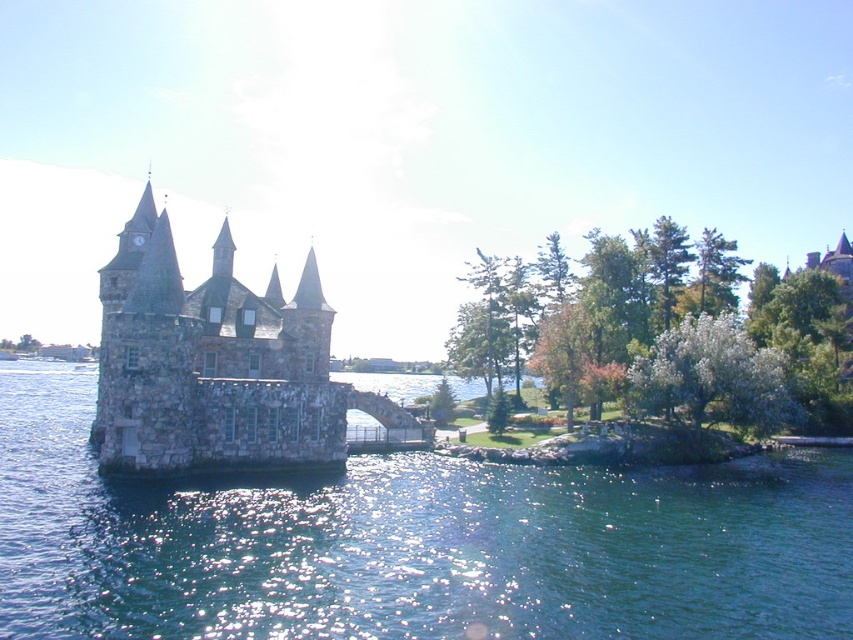
Can you confirm if clear blue water at center is positioned above stone castle at center?

Incorrect, clear blue water at center is not positioned above stone castle at center.

Is point (480, 608) farther from viewer compared to point (189, 428)?

No, it is in front of (189, 428).

You are a GUI agent. You are given a task and a screenshot of the screen. Output one action in this format:
    pyautogui.click(x=<x>, y=<y>)
    Task: Click on the clear blue water at center
    The width and height of the screenshot is (853, 640).
    Given the screenshot: What is the action you would take?
    (x=410, y=544)